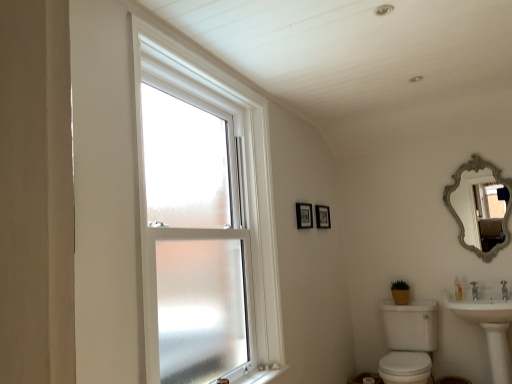
Question: Considering the relative sizes of white glossy sink at lower right, the second sink positioned from the left, and wooden picture frame at upper center, positioned as the second picture frame in left-to-right order, in the image provided, is white glossy sink at lower right, the second sink positioned from the left, wider than wooden picture frame at upper center, positioned as the second picture frame in left-to-right order,?

Choices:
 (A) no
 (B) yes

Answer: (B)

Question: Considering the relative sizes of white glossy sink at lower right, the 1th sink viewed from the right, and wooden picture frame at upper center, positioned as the second picture frame in left-to-right order, in the image provided, is white glossy sink at lower right, the 1th sink viewed from the right, shorter than wooden picture frame at upper center, positioned as the second picture frame in left-to-right order,?

Choices:
 (A) no
 (B) yes

Answer: (A)

Question: Considering the relative positions of white glossy sink at lower right, the 1th sink viewed from the right, and wooden picture frame at upper center, the first picture frame viewed from the back, in the image provided, is white glossy sink at lower right, the 1th sink viewed from the right, behind wooden picture frame at upper center, the first picture frame viewed from the back,?

Choices:
 (A) no
 (B) yes

Answer: (A)

Question: Is wooden picture frame at upper center, positioned as the 1th picture frame in right-to-left order, a part of white glossy sink at lower right, the second sink positioned from the left?

Choices:
 (A) yes
 (B) no

Answer: (B)

Question: Is white glossy sink at lower right, the second sink positioned from the left, beside wooden picture frame at upper center, placed as the second picture frame when sorted from front to back?

Choices:
 (A) no
 (B) yes

Answer: (A)

Question: From the image's perspective, relative to silver/gilded ornate mirror at upper right, is white plastic window sill at lower center above or below?

Choices:
 (A) above
 (B) below

Answer: (B)

Question: Is white plastic window sill at lower center taller or shorter than silver/gilded ornate mirror at upper right?

Choices:
 (A) short
 (B) tall

Answer: (A)

Question: Is white plastic window sill at lower center in front of or behind silver/gilded ornate mirror at upper right in the image?

Choices:
 (A) behind
 (B) front

Answer: (B)

Question: Is white plastic window sill at lower center wider or thinner than silver/gilded ornate mirror at upper right?

Choices:
 (A) wide
 (B) thin

Answer: (A)

Question: Is white glossy sink at lower right, the second sink positioned from the left, in front of or behind white glossy sink at lower right, arranged as the 2th sink when viewed from the right, in the image?

Choices:
 (A) front
 (B) behind

Answer: (A)

Question: From a real-world perspective, is white glossy sink at lower right, the 1th sink viewed from the right, above or below white glossy sink at lower right, arranged as the 2th sink when viewed from the right?

Choices:
 (A) above
 (B) below

Answer: (A)

Question: Is point (496, 311) positioned closer to the camera than point (395, 331)?

Choices:
 (A) farther
 (B) closer

Answer: (B)

Question: Is white glossy sink at lower right, the 1th sink viewed from the right, bigger or smaller than white glossy sink at lower right, the first sink positioned from the left?

Choices:
 (A) small
 (B) big

Answer: (A)

Question: Is point coord(297,203) closer or farther from the camera than point coord(494,370)?

Choices:
 (A) farther
 (B) closer

Answer: (A)

Question: Is matte black picture frame at upper center, which ranks as the first picture frame in front-to-back order, to the left or to the right of white glossy sink at lower right, the second sink positioned from the left, in the image?

Choices:
 (A) left
 (B) right

Answer: (A)